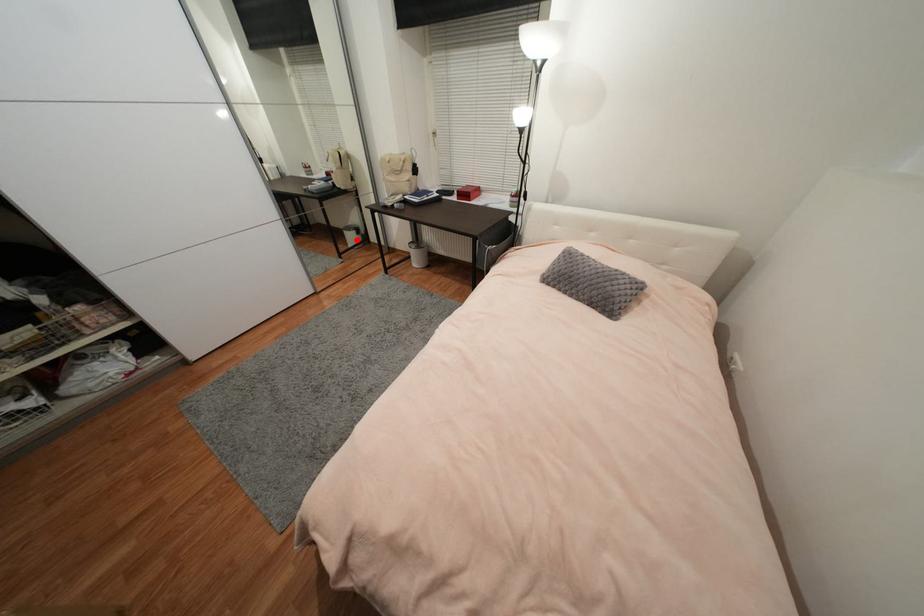
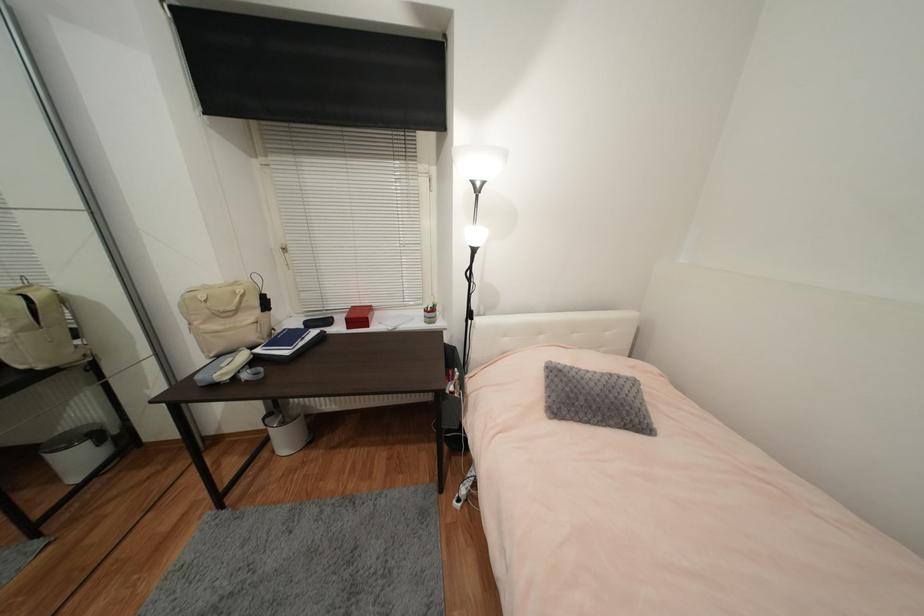
Where in the second image is the point corresponding to the highlighted location from the first image?

(83, 462)